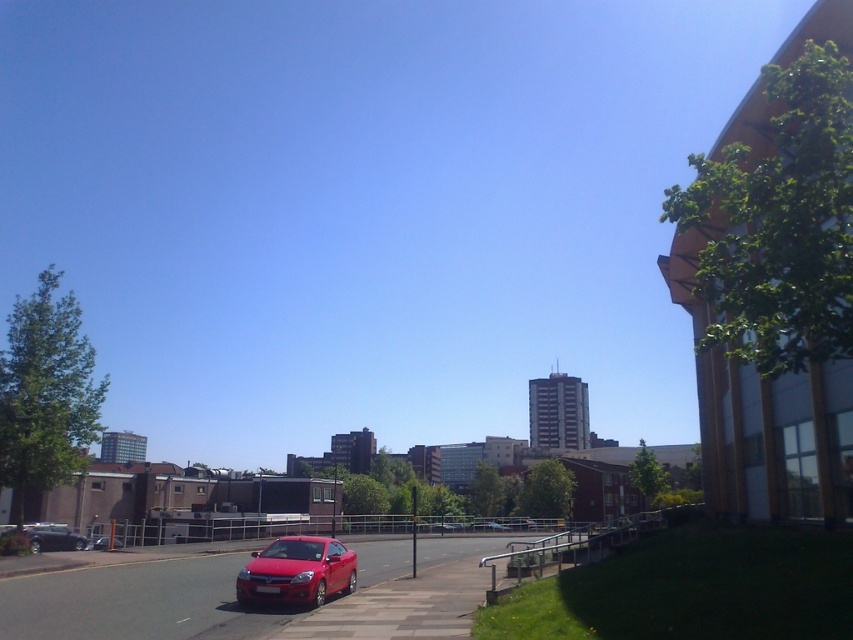
Question: Is smooth asphalt road at lower center behind glossy red car at center?

Choices:
 (A) no
 (B) yes

Answer: (A)

Question: Which of the following is the closest to the observer?

Choices:
 (A) glossy red car at center
 (B) smooth asphalt road at lower center

Answer: (B)

Question: Which object is positioned closest to the matte black car at lower left?

Choices:
 (A) glossy red car at center
 (B) smooth asphalt road at lower center

Answer: (B)

Question: Is smooth asphalt road at lower center smaller than matte black car at lower left?

Choices:
 (A) yes
 (B) no

Answer: (B)

Question: Which is nearer to the matte black car at lower left?

Choices:
 (A) smooth asphalt road at lower center
 (B) glossy red car at center

Answer: (A)

Question: Can you confirm if smooth asphalt road at lower center is thinner than glossy red car at center?

Choices:
 (A) no
 (B) yes

Answer: (A)